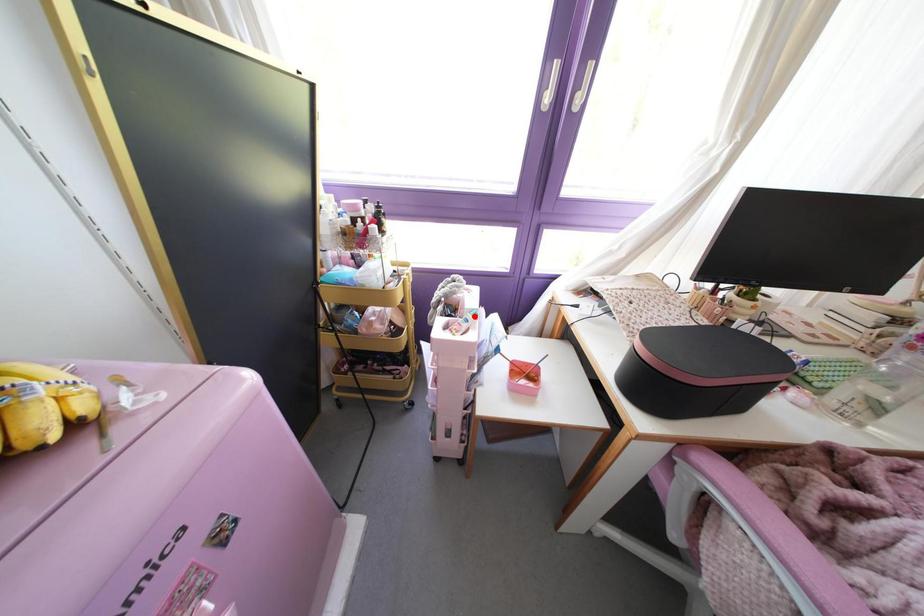
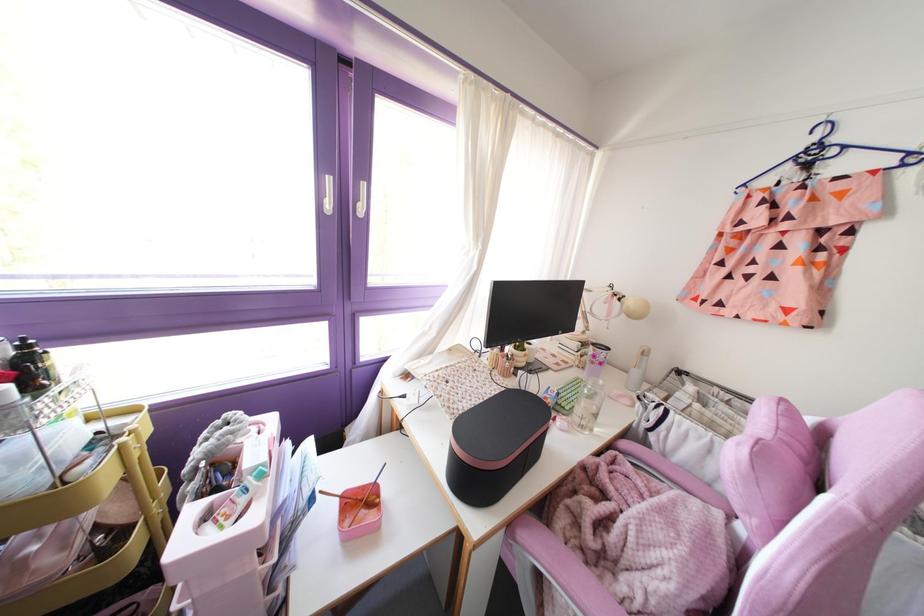
The point at the highlighted location is marked in the first image. Where is the corresponding point in the second image?

(261, 475)